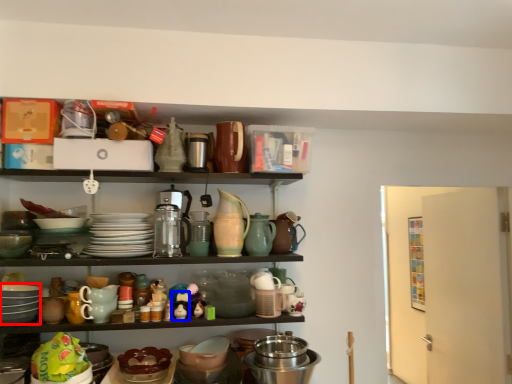
Question: Which of the following is the closest to the observer, tableware (highlighted by a red box) or toy (highlighted by a blue box)?

Choices:
 (A) tableware
 (B) toy

Answer: (A)